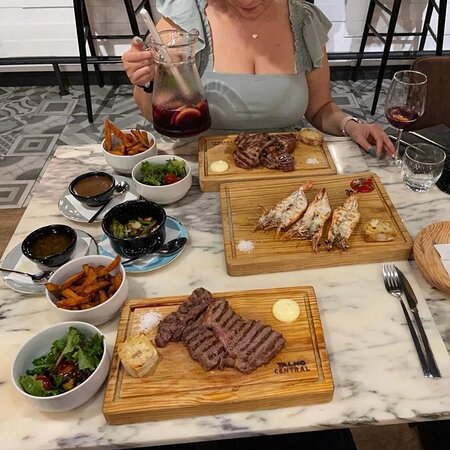
Where is `drinkware`? The height and width of the screenshot is (450, 450). drinkware is located at coordinates (410, 96), (414, 169), (170, 96).